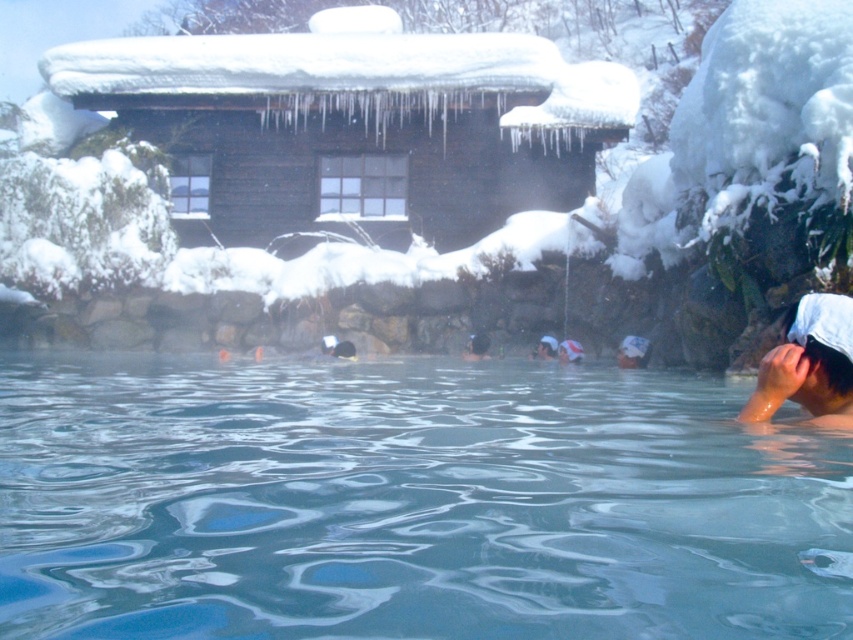
Is clear water at center shorter than white cloth headband at lower right?

Correct, clear water at center is not as tall as white cloth headband at lower right.

Between clear water at center and white cloth headband at lower right, which one has more height?

white cloth headband at lower right is taller.

Is point (668, 452) behind point (844, 413)?

That is False.

This screenshot has width=853, height=640. What are the coordinates of `clear water at center` in the screenshot? It's located at (408, 502).